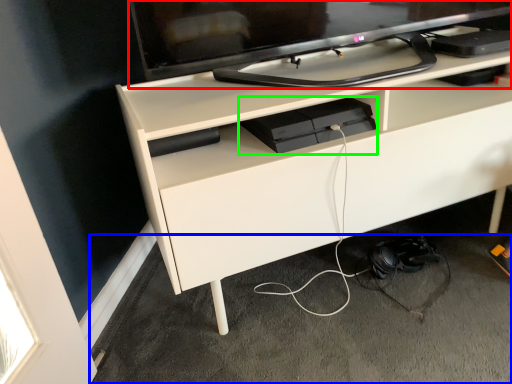
Question: Which is nearer to the television (highlighted by a red box)? concrete (highlighted by a blue box) or equipment (highlighted by a green box).

Choices:
 (A) concrete
 (B) equipment

Answer: (B)